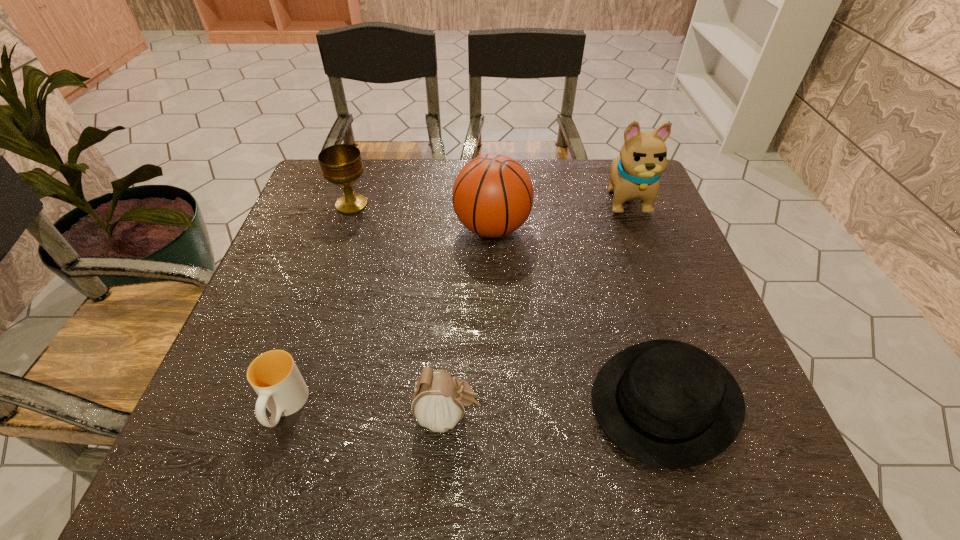
You are a GUI agent. You are given a task and a screenshot of the screen. Output one action in this format:
    pyautogui.click(x=<x>, y=<y>)
    Task: Click on the puppy situated at the right edge
    This screenshot has height=540, width=960.
    Given the screenshot: What is the action you would take?
    pyautogui.click(x=635, y=173)

The width and height of the screenshot is (960, 540). In order to click on fedora that is positioned at the right edge in this screenshot , I will do `click(668, 404)`.

Where is `object that is positioned at the far left corner`? This screenshot has height=540, width=960. object that is positioned at the far left corner is located at coordinates (341, 164).

Locate an element on the screen. This screenshot has width=960, height=540. object that is at the near left corner is located at coordinates (274, 376).

The height and width of the screenshot is (540, 960). I want to click on object that is at the far right corner, so click(635, 173).

Where is `object at the near right corner`? object at the near right corner is located at coordinates (668, 404).

Where is `vacant space at the far edge of the desktop`? The image size is (960, 540). vacant space at the far edge of the desktop is located at coordinates (452, 162).

The height and width of the screenshot is (540, 960). I want to click on free space at the near edge, so click(x=426, y=482).

In the image, there is a desktop. At what (x,y) coordinates should I click in order to perform the action: click on vacant area at the left edge. Please return your answer as a coordinate pair (x, y). Looking at the image, I should click on (284, 241).

Where is `free space at the right edge`? This screenshot has width=960, height=540. free space at the right edge is located at coordinates (606, 218).